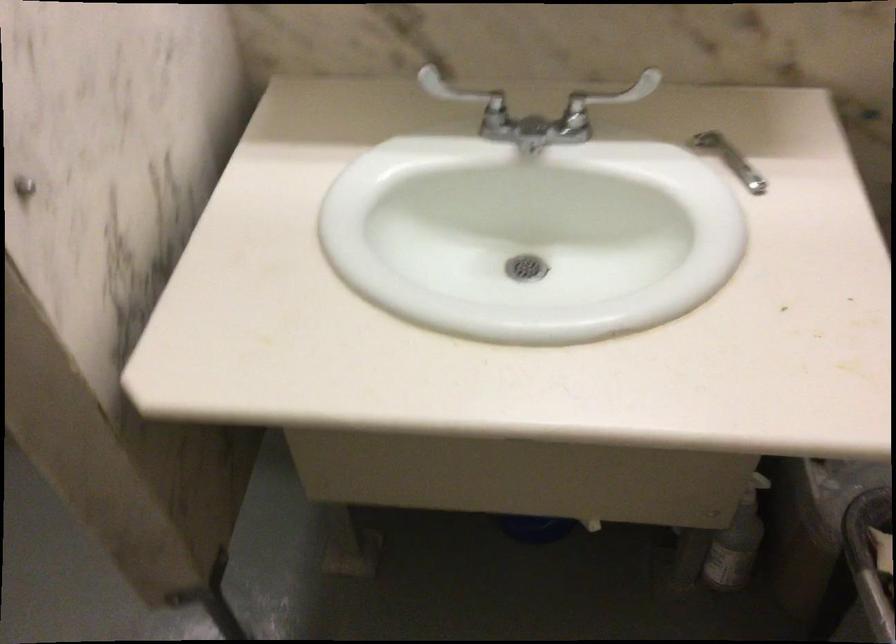
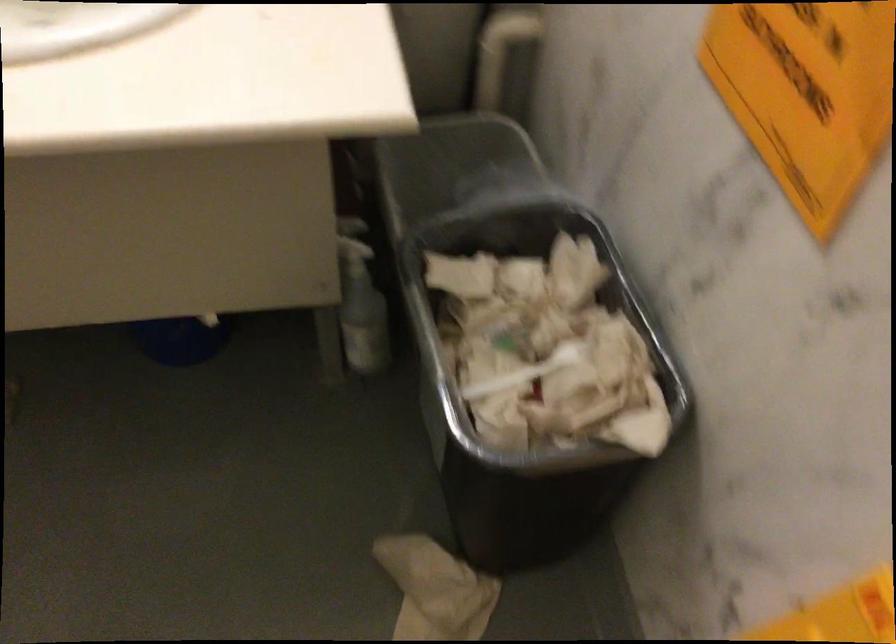
Question: In a continuous first-person perspective shot, in which direction is the camera moving?

Choices:
 (A) Left
 (B) Right
 (C) Forward
 (D) Backward

Answer: (B)